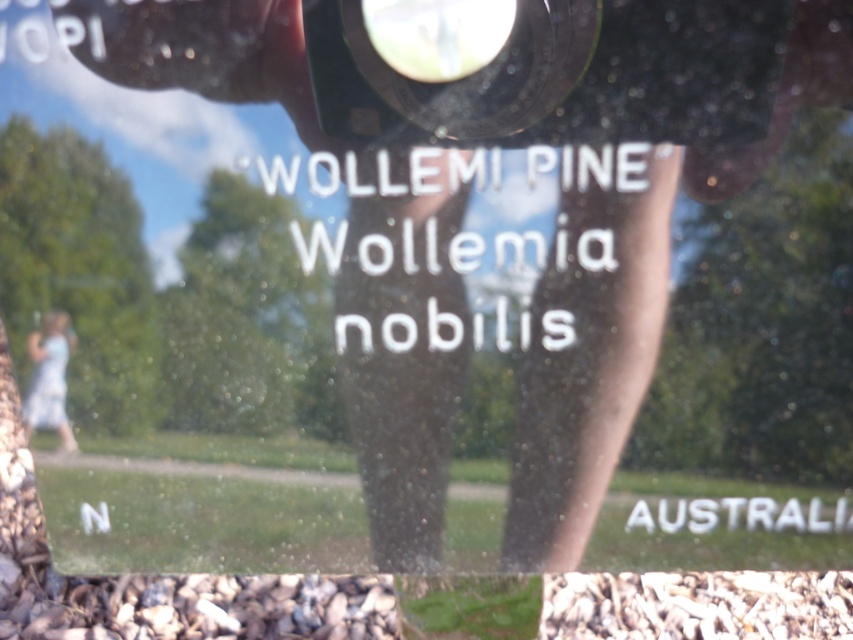
You are a photographer trying to capture the sign about the Wollemi Pine. You notice the black plastic lens at upper center and the light blue fabric dress at lower left in your frame. Which object in your viewfinder is bigger?

The black plastic lens at upper center is larger in size than the light blue fabric dress at lower left, so the black plastic lens at upper center appears bigger in your viewfinder.

You are standing in front of the Wollemi Pine sign and notice the black plastic lens at upper center and the light blue fabric dress at lower left in your view. Which object appears shorter in height?

The black plastic lens at upper center is not as tall as the light blue fabric dress at lower left, so the black plastic lens at upper center appears shorter in height.